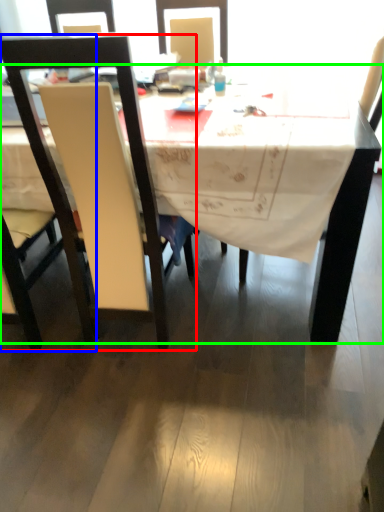
Question: Considering the real-world distances, which object is closest to chair (highlighted by a red box)? chair (highlighted by a blue box) or desk (highlighted by a green box).

Choices:
 (A) chair
 (B) desk

Answer: (A)